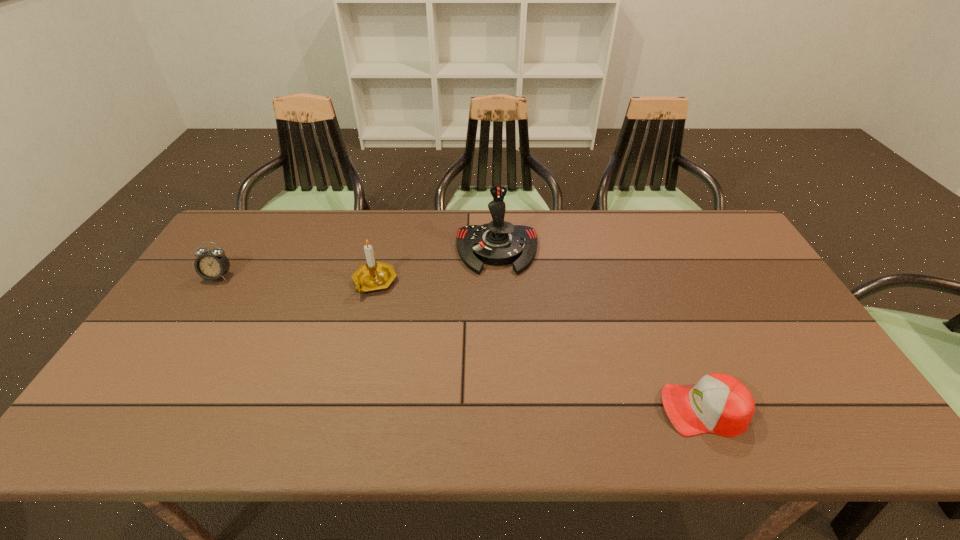
This screenshot has height=540, width=960. Identify the location of vacant region between the third shortest object and the joystick. (436, 266).

Identify which object is located as the third nearest to the shortest object. Please provide its 2D coordinates. Your answer should be formatted as a tuple, i.e. [(x, y)], where the tuple contains the x and y coordinates of a point satisfying the conditions above.

[(211, 265)]

Where is `object that is the third closest one to the second object from left to right`? The image size is (960, 540). object that is the third closest one to the second object from left to right is located at coordinates (719, 403).

The image size is (960, 540). I want to click on vacant space that satisfies the following two spatial constraints: 1. on the face of the candle holder; 2. on the left side of the alarm clock, so click(x=215, y=282).

This screenshot has width=960, height=540. I want to click on free location that satisfies the following two spatial constraints: 1. on the face of the third shortest object; 2. on the left side of the second shortest object, so click(215, 282).